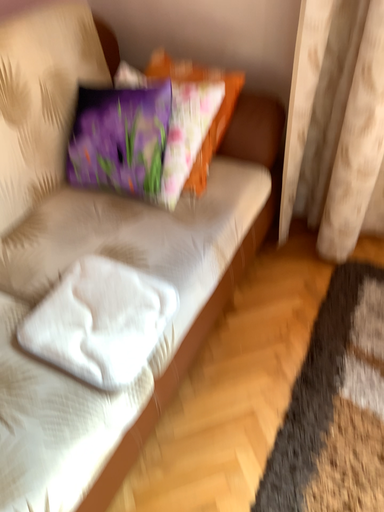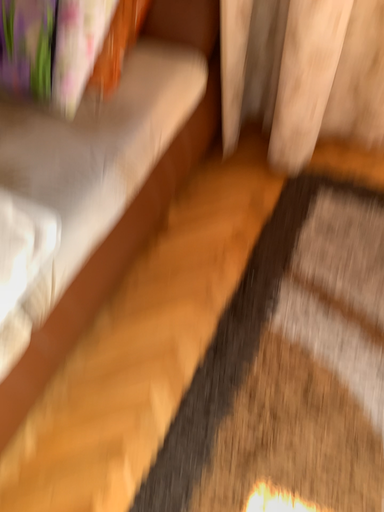
Question: Which way did the camera rotate in the video?

Choices:
 (A) rotated upward
 (B) rotated downward

Answer: (B)